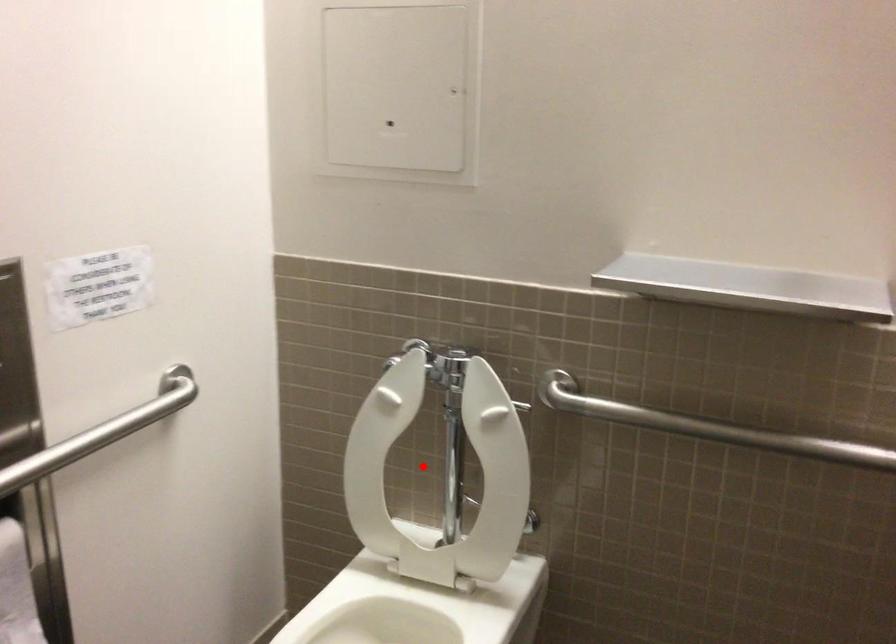
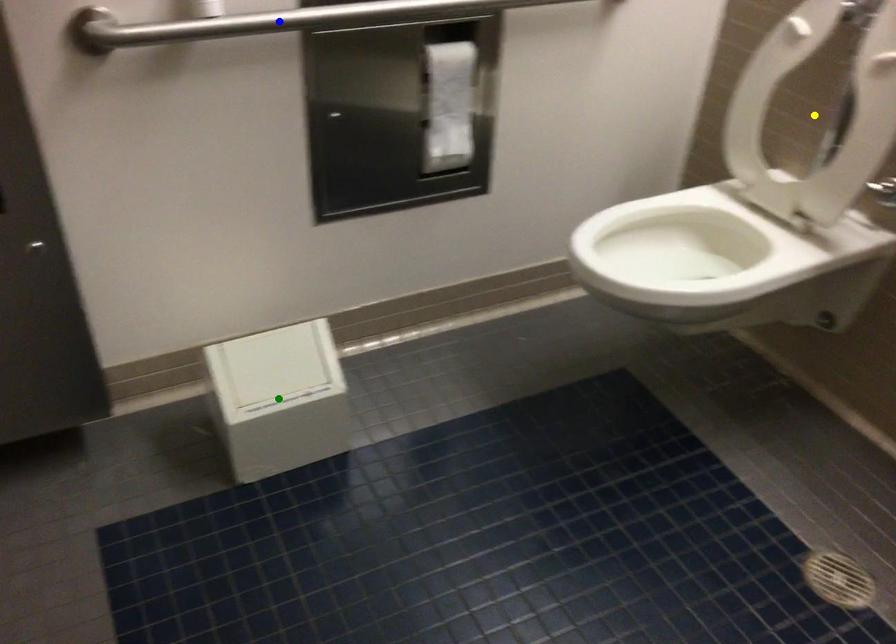
Question: I am providing you with two images of the same scene from different viewpoints. A red point is marked on the first image. You are given multiple points on the second image. Can you choose the point in image 2 that corresponds to the point in image 1?

Choices:
 (A) blue point
 (B) yellow point
 (C) green point

Answer: (B)